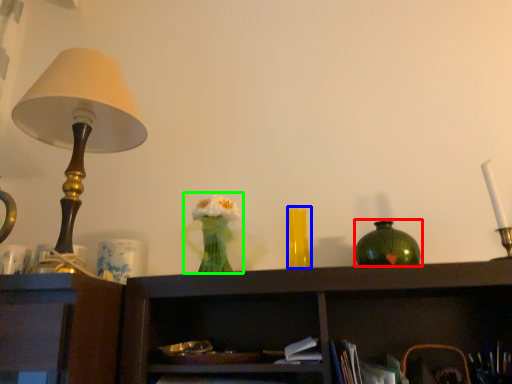
Question: Based on their relative distances, which object is nearer to vase (highlighted by a red box)? Choose from vase (highlighted by a blue box) and floral arrangement (highlighted by a green box).

Choices:
 (A) vase
 (B) floral arrangement

Answer: (A)